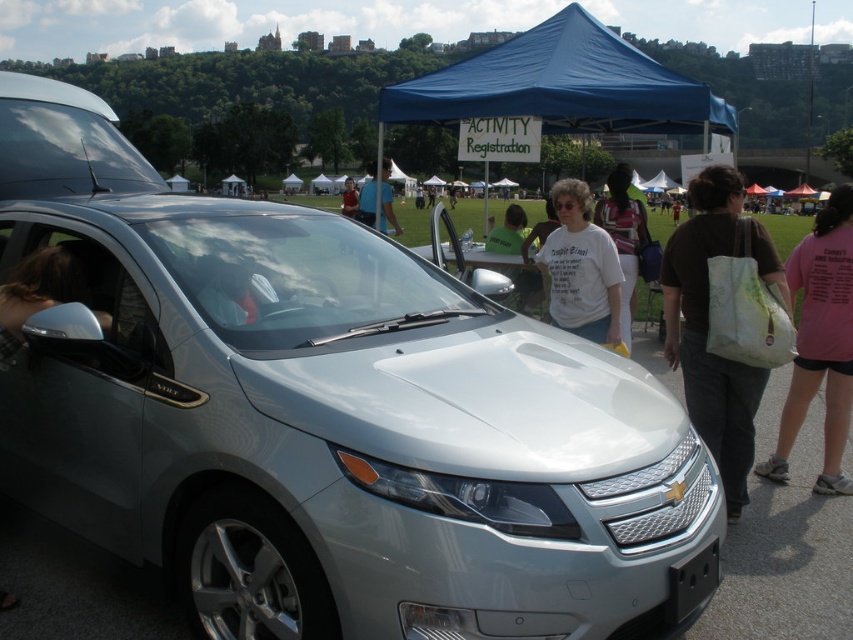
Question: Among these objects, which one is nearest to the camera?

Choices:
 (A) white cotton shirt at center
 (B) matte white tote bag at right
 (C) matte black shirt at center

Answer: (B)

Question: Can you confirm if metallic silver minivan at upper left is bigger than white cotton shirt at center?

Choices:
 (A) no
 (B) yes

Answer: (A)

Question: Estimate the real-world distances between objects in this image. Which object is farther from the white cotton shirt at center?

Choices:
 (A) white cotton t-shirt at center
 (B) blue fabric canopy at upper center
 (C) pink cotton t-shirt at center-right
 (D) metallic silver minivan at upper left

Answer: (D)

Question: Which point is closer to the camera taking this photo?

Choices:
 (A) (790, 305)
 (B) (350, 202)

Answer: (A)

Question: In this image, where is blue fabric canopy at upper center located relative to metallic silver minivan at upper left?

Choices:
 (A) above
 (B) below

Answer: (A)

Question: Is blue fabric canopy at upper center thinner than white cotton t-shirt at center?

Choices:
 (A) yes
 (B) no

Answer: (B)